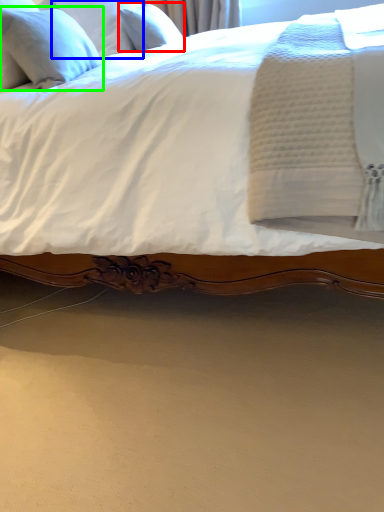
Question: Based on their relative distances, which object is farther from pillow (highlighted by a red box)? Choose from pillow (highlighted by a blue box) and pillow (highlighted by a green box).

Choices:
 (A) pillow
 (B) pillow

Answer: (B)